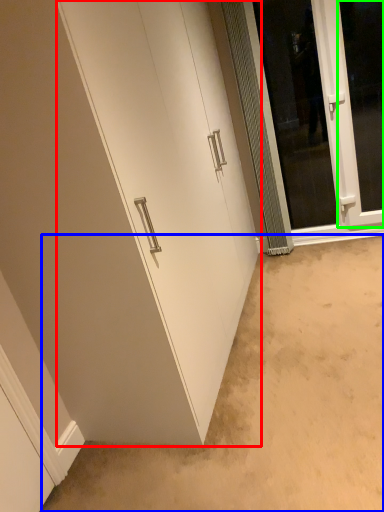
Question: Which object is positioned farthest from door (highlighted by a red box)? Select from plain (highlighted by a blue box) and window (highlighted by a green box).

Choices:
 (A) plain
 (B) window

Answer: (B)